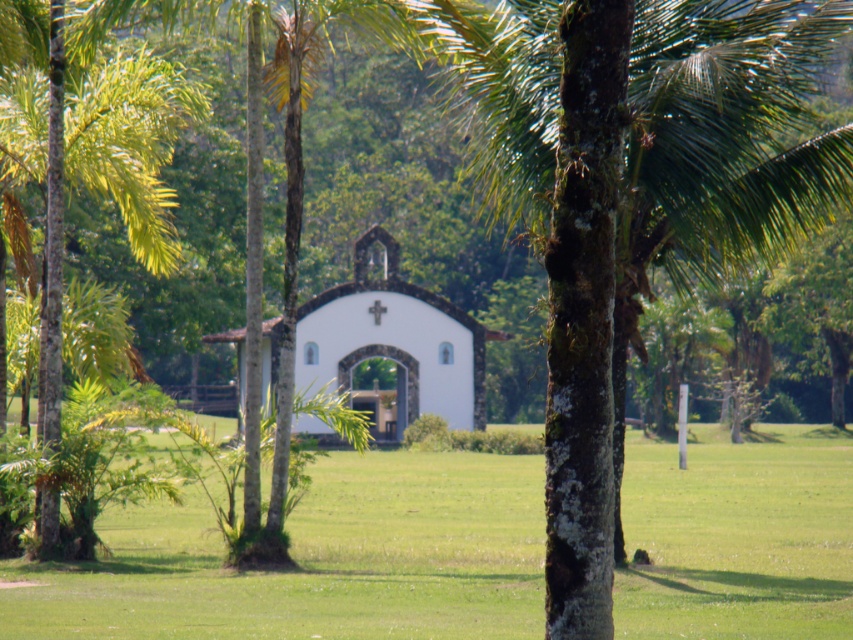
Question: Which of the following is the farthest from the observer?

Choices:
 (A) white matte church at center
 (B) green grass at center
 (C) green rough bark palm tree at center
 (D) green leafy palm tree at lower left

Answer: (A)

Question: Considering the relative positions of green rough bark palm tree at center and green grass at center in the image provided, where is green rough bark palm tree at center located with respect to green grass at center?

Choices:
 (A) left
 (B) right

Answer: (B)

Question: Does green rough bark palm tree at center have a smaller size compared to white matte church at center?

Choices:
 (A) yes
 (B) no

Answer: (B)

Question: Which of these objects is positioned closest to the green leafy palm tree at lower left?

Choices:
 (A) white matte church at center
 (B) green rough bark palm tree at center

Answer: (B)

Question: In this image, where is green leafy palm tree at lower left located relative to white matte church at center?

Choices:
 (A) below
 (B) above

Answer: (B)

Question: Which object is closer to the camera taking this photo?

Choices:
 (A) white matte church at center
 (B) green leafy palm tree at lower left
 (C) green rough bark palm tree at center
 (D) green grass at center

Answer: (C)